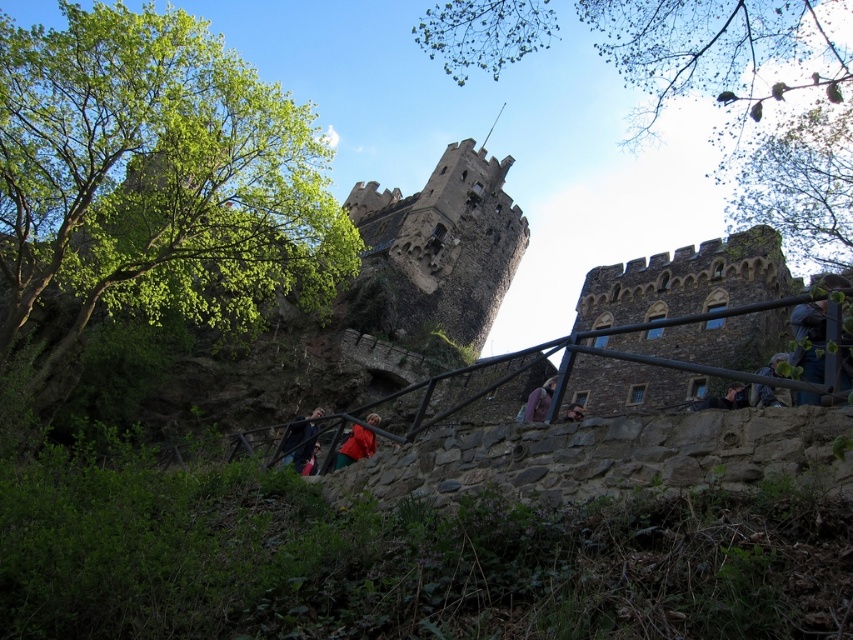
Based on the scene described, which object is wider when comparing the stone tower at center and the dark blue fabric jacket at lower center?

The stone tower at center is wider than the dark blue fabric jacket at lower center.

You are standing at the base of the castle hill and want to reach the point marked at coordinates [403,289]. Given that the distance between you and this point is 123.89 meters, would you need to climb the stone staircase leading up to the castle?

Yes, you would need to climb the stone staircase leading up to the castle because the point marked at coordinates [403,289] is 123.89 meters away from you, which is the distance of the staircase leading up to the castle.